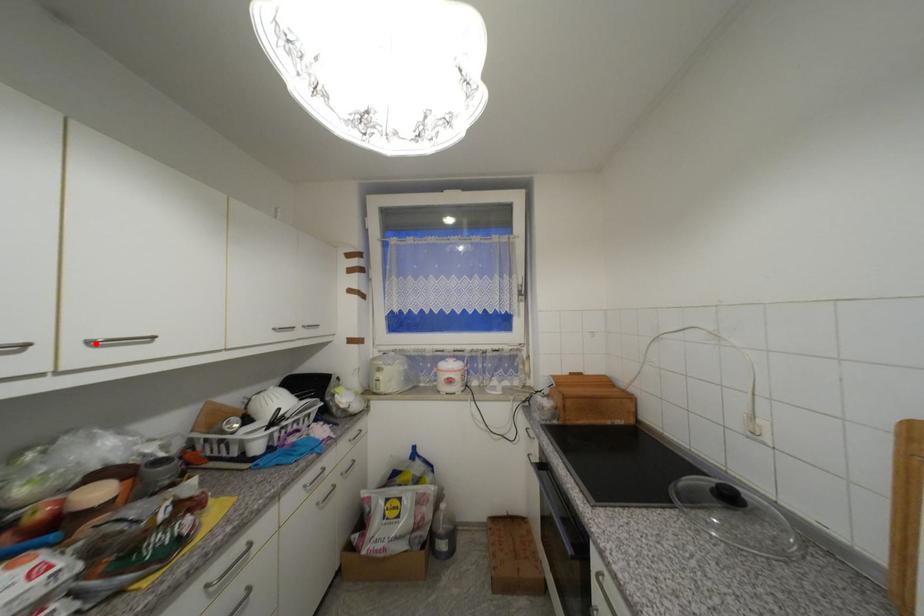
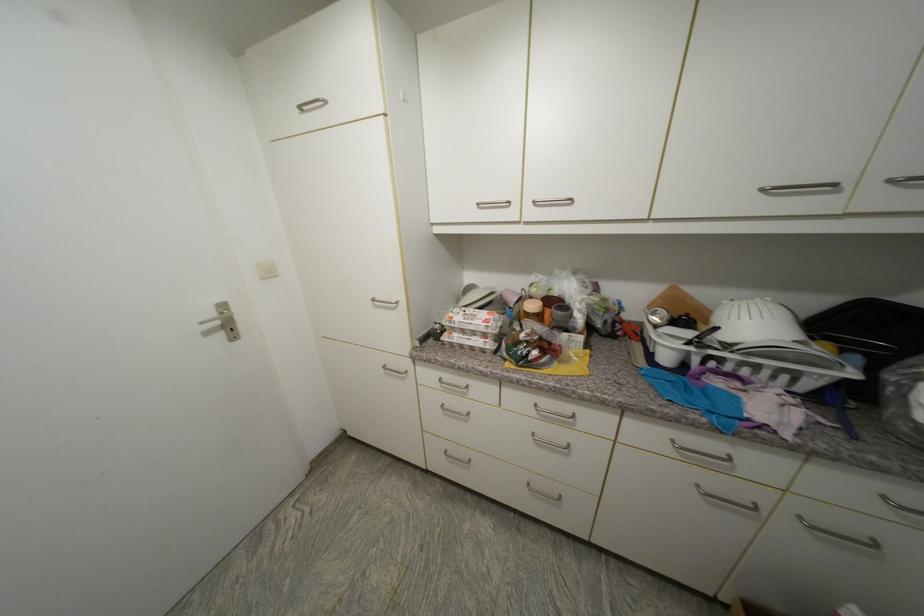
The point at the highlighted location is marked in the first image. Where is the corresponding point in the second image?

(540, 204)